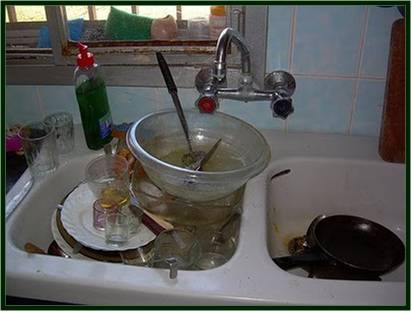
Identify the location of left side of sink. Image resolution: width=412 pixels, height=312 pixels. (40, 222).